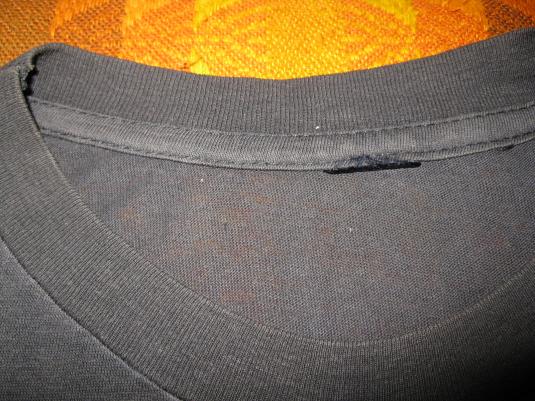
Image resolution: width=535 pixels, height=401 pixels. I want to click on orange fabric, so click(x=279, y=33).